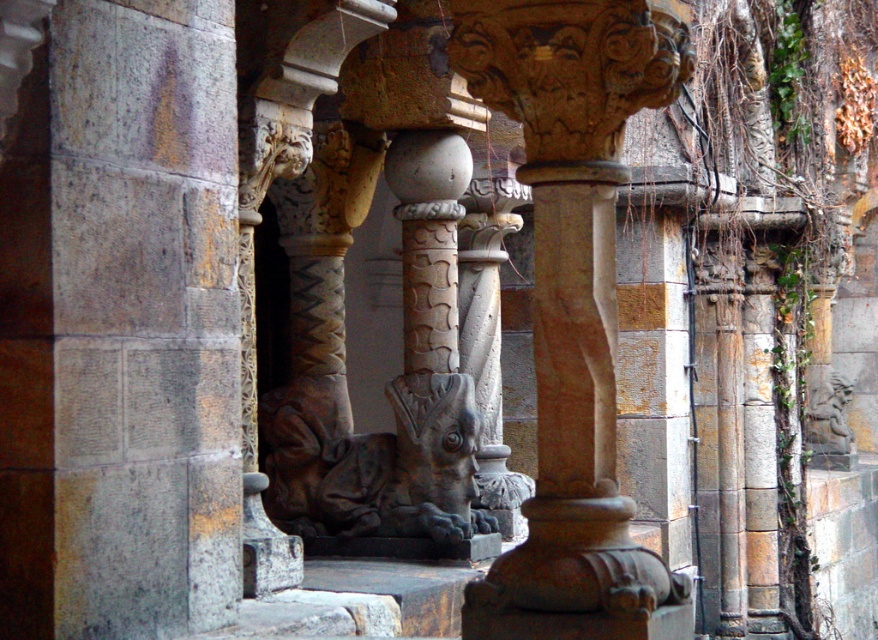
Question: Where is gray stone pillar at left located in relation to smooth stone column at center in the image?

Choices:
 (A) right
 (B) left

Answer: (B)

Question: Can you confirm if gray stone pillar at left is wider than smooth stone column at center?

Choices:
 (A) no
 (B) yes

Answer: (B)

Question: Which point is closer to the camera?

Choices:
 (A) dark gray stone gargoyle at center
 (B) smooth stone column at center

Answer: (B)

Question: Among these objects, which one is nearest to the camera?

Choices:
 (A) smooth stone column at center
 (B) dark gray stone gargoyle at center
 (C) gray stone pillar at left

Answer: (A)

Question: Which of these objects is positioned closest to the dark gray stone gargoyle at center?

Choices:
 (A) smooth stone column at center
 (B) gray stone pillar at left

Answer: (B)

Question: Can you confirm if gray stone pillar at left is thinner than smooth stone column at center?

Choices:
 (A) yes
 (B) no

Answer: (B)